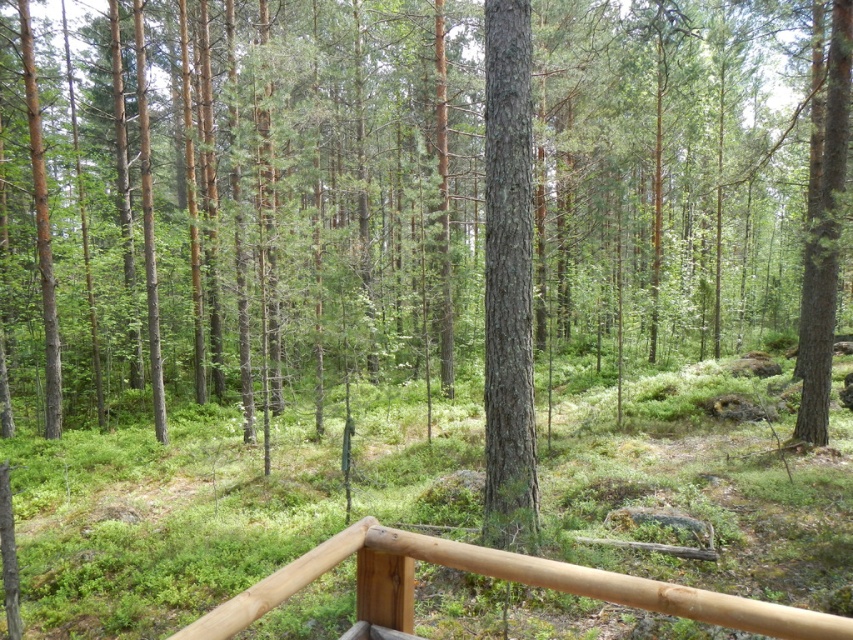
You are standing on the wooden railing in the forest scene. You want to touch the point at coordinate point (508, 280). Which object in the scene should you reach out to?

The point at coordinate point (508, 280) is located on the smooth bark tree at center, so you should reach out to the smooth bark tree at center to touch it.